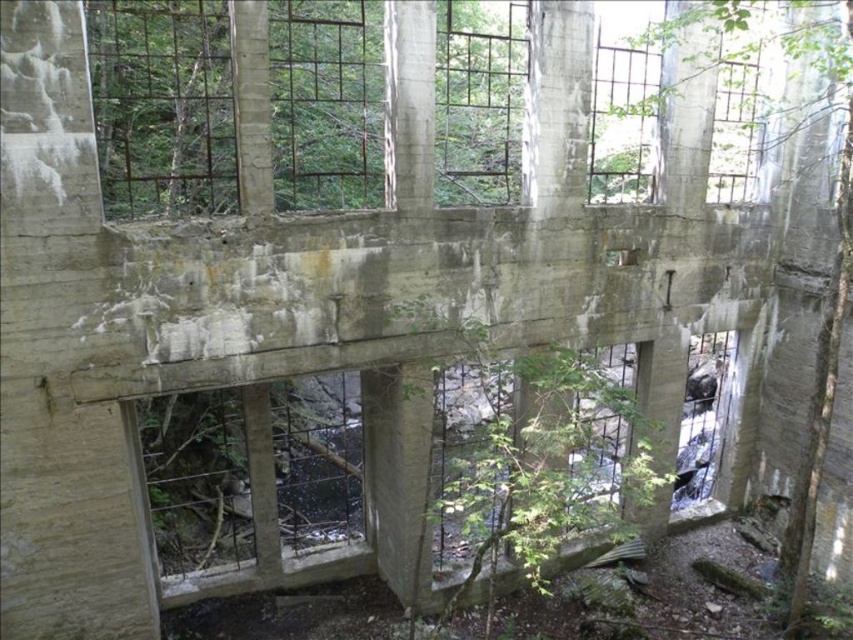
Question: Does rusty metal window at center appear under green leafy tree at right?

Choices:
 (A) no
 (B) yes

Answer: (B)

Question: Does rusty metal window at center have a smaller size compared to green leafy tree at right?

Choices:
 (A) no
 (B) yes

Answer: (A)

Question: Which point is farther to the camera?

Choices:
 (A) (798, 588)
 (B) (247, 420)

Answer: (A)

Question: Among these objects, which one is nearest to the camera?

Choices:
 (A) green leafy tree at right
 (B) rusty metal window at center

Answer: (A)

Question: Which object is farther from the camera taking this photo?

Choices:
 (A) green leafy tree at right
 (B) rusty metal window at center

Answer: (B)

Question: Is rusty metal window at center to the left of green leafy tree at right from the viewer's perspective?

Choices:
 (A) yes
 (B) no

Answer: (A)